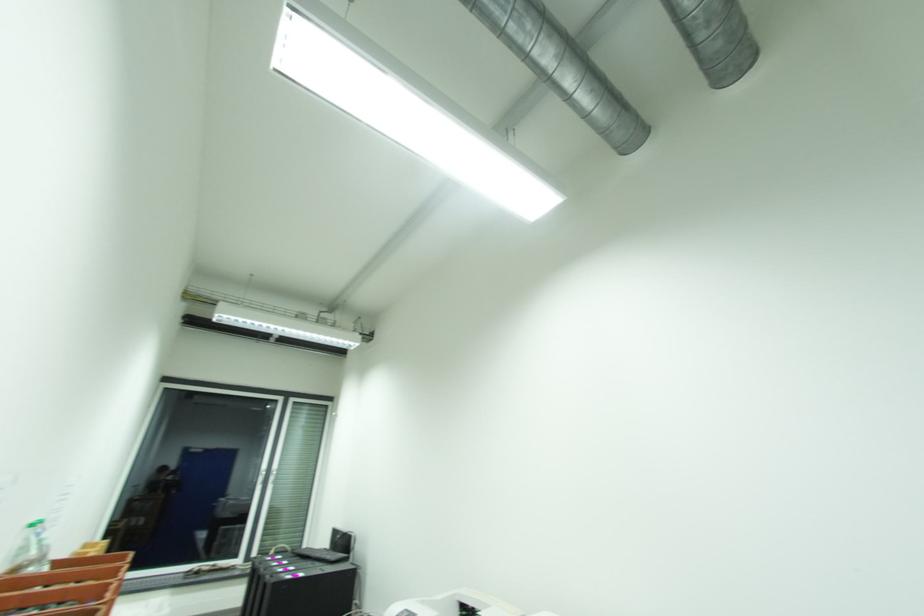
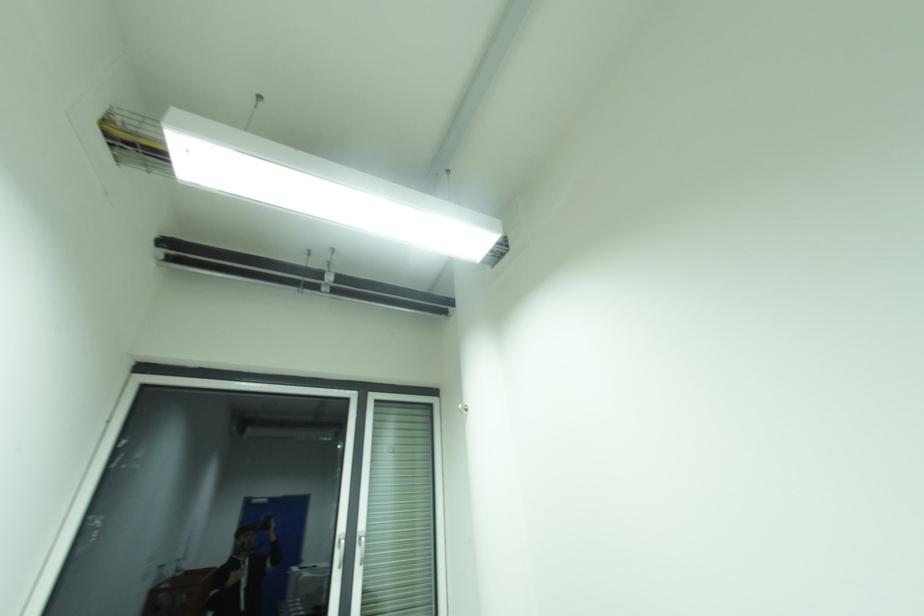
What movement of the cameraman would produce the second image?

The cameraman walked toward left, forward.